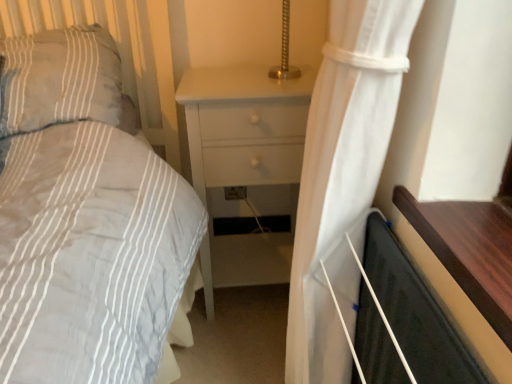
What do you see at coordinates (343, 177) in the screenshot? I see `white sheer curtain at right` at bounding box center [343, 177].

The height and width of the screenshot is (384, 512). What do you see at coordinates (414, 312) in the screenshot?
I see `black matte screen door at lower right` at bounding box center [414, 312].

What is the approximate height of gray striped pillow at upper left?

The height of gray striped pillow at upper left is 9.07 inches.

Find the location of `white matte nightstand at center`. white matte nightstand at center is located at coordinates (238, 100).

From the picture: Is gray striped pillow at upper left taller than black matte screen door at lower right?

In fact, gray striped pillow at upper left may be shorter than black matte screen door at lower right.

Would you say gray striped pillow at upper left is a long distance from black matte screen door at lower right?

gray striped pillow at upper left is actually quite close to black matte screen door at lower right.

Considering the relative sizes of gray striped pillow at upper left and black matte screen door at lower right in the image provided, is gray striped pillow at upper left smaller than black matte screen door at lower right?

No.

The height and width of the screenshot is (384, 512). I want to click on screen door on the right of gray striped pillow at upper left, so click(x=414, y=312).

Considering the relative sizes of black matte screen door at lower right and gray striped pillow at upper left in the image provided, is black matte screen door at lower right wider than gray striped pillow at upper left?

No.

What's the angular difference between black matte screen door at lower right and gray striped pillow at upper left's facing directions?

The facing directions of black matte screen door at lower right and gray striped pillow at upper left are 92.8 degrees apart.

Considering the relative sizes of black matte screen door at lower right and gray striped pillow at upper left in the image provided, is black matte screen door at lower right shorter than gray striped pillow at upper left?

Incorrect, the height of black matte screen door at lower right does not fall short of that of gray striped pillow at upper left.

Does black matte screen door at lower right come behind gray striped pillow at upper left?

No, black matte screen door at lower right is closer to the camera.

Is black matte screen door at lower right oriented away from white sheer curtain at right?

Yes, white sheer curtain at right is at the back of black matte screen door at lower right.

Is black matte screen door at lower right to the left or to the right of white sheer curtain at right in the image?

In the image, black matte screen door at lower right appears on the right side of white sheer curtain at right.

The image size is (512, 384). In order to click on curtain located above the black matte screen door at lower right (from a real-world perspective) in this screenshot , I will do `click(343, 177)`.

Looking at this image, how much distance is there between white matte nightstand at center and black matte screen door at lower right?

white matte nightstand at center and black matte screen door at lower right are 21.57 inches apart from each other.

You are a GUI agent. You are given a task and a screenshot of the screen. Output one action in this format:
    pyautogui.click(x=<x>, y=<y>)
    Task: Click on the nightstand on the left of black matte screen door at lower right
    The image size is (512, 384).
    Given the screenshot: What is the action you would take?
    pyautogui.click(x=238, y=100)

In the image, is white matte nightstand at center positioned in front of or behind black matte screen door at lower right?

Clearly, white matte nightstand at center is behind black matte screen door at lower right.

Does point (204, 168) come in front of point (417, 295)?

No, it is not.

Is black matte screen door at lower right inside white sheer curtain at right?

No, black matte screen door at lower right is not a part of white sheer curtain at right.

Can you tell me how much white sheer curtain at right and black matte screen door at lower right differ in facing direction?

The facing directions of white sheer curtain at right and black matte screen door at lower right are 0.327 degrees apart.

Is white sheer curtain at right oriented away from black matte screen door at lower right?

Yes, black matte screen door at lower right is at the back of white sheer curtain at right.

Is there a large distance between white sheer curtain at right and black matte screen door at lower right?

Actually, white sheer curtain at right and black matte screen door at lower right are a little close together.

Which object is thinner, white sheer curtain at right or gray striped pillow at upper left?

white sheer curtain at right is thinner.

Can you confirm if white sheer curtain at right is positioned to the left of gray striped pillow at upper left?

No.

From a real-world perspective, between white sheer curtain at right and gray striped pillow at upper left, who is vertically higher?

gray striped pillow at upper left is physically above.

Which is closer to the camera, (337, 283) or (100, 70)?

The point (337, 283) is closer to the camera.

Which is behind, point (59, 52) or point (247, 93)?

The point (59, 52) is behind.

Which of these two, gray striped pillow at upper left or white matte nightstand at center, stands taller?

With more height is white matte nightstand at center.

From the image's perspective, would you say gray striped pillow at upper left is positioned over white matte nightstand at center?

Correct, gray striped pillow at upper left appears higher than white matte nightstand at center in the image.

Which object is closer to the camera taking this photo, gray striped pillow at upper left or white matte nightstand at center?

gray striped pillow at upper left.

At what (x,y) coordinates should I click in order to perform the action: click on pillow behind the black matte screen door at lower right. Please return your answer as a coordinate pair (x, y). Looking at the image, I should click on (59, 79).

This screenshot has width=512, height=384. I want to click on screen door below the gray striped pillow at upper left (from a real-world perspective), so pyautogui.click(x=414, y=312).

Based on the photo, which object lies further to the anchor point white sheer curtain at right, white matte nightstand at center or gray striped pillow at upper left?

Among the two, gray striped pillow at upper left is located further to white sheer curtain at right.

When comparing their distances from gray striped pillow at upper left, does white matte nightstand at center or white sheer curtain at right seem further?

Among the two, white sheer curtain at right is located further to gray striped pillow at upper left.

When comparing their distances from white matte nightstand at center, does white sheer curtain at right or black matte screen door at lower right seem closer?

The object closer to white matte nightstand at center is white sheer curtain at right.

Considering their positions, is white matte nightstand at center positioned closer to black matte screen door at lower right than gray striped pillow at upper left?

Among the two, white matte nightstand at center is located nearer to black matte screen door at lower right.

Estimate the real-world distances between objects in this image. Which object is further from gray striped pillow at upper left, black matte screen door at lower right or white sheer curtain at right?

Based on the image, black matte screen door at lower right appears to be further to gray striped pillow at upper left.

Considering their positions, is black matte screen door at lower right positioned closer to white sheer curtain at right than gray striped pillow at upper left?

Based on the image, black matte screen door at lower right appears to be nearer to white sheer curtain at right.

From the picture: Estimate the real-world distances between objects in this image. Which object is closer to gray striped pillow at upper left, white sheer curtain at right or white matte nightstand at center?

Among the two, white matte nightstand at center is located nearer to gray striped pillow at upper left.

Considering their positions, is gray striped pillow at upper left positioned further to white matte nightstand at center than white sheer curtain at right?

Based on the image, white sheer curtain at right appears to be further to white matte nightstand at center.

Identify the location of nightstand between gray striped pillow at upper left and white sheer curtain at right in the horizontal direction. The height and width of the screenshot is (384, 512). (238, 100).

I want to click on curtain between gray striped pillow at upper left and black matte screen door at lower right, so click(x=343, y=177).

You are a GUI agent. You are given a task and a screenshot of the screen. Output one action in this format:
    pyautogui.click(x=<x>, y=<y>)
    Task: Click on the screen door positioned between white sheer curtain at right and white matte nightstand at center from near to far
    The image size is (512, 384).
    Given the screenshot: What is the action you would take?
    pyautogui.click(x=414, y=312)

This screenshot has height=384, width=512. Identify the location of nightstand between gray striped pillow at upper left and black matte screen door at lower right in the horizontal direction. (238, 100).